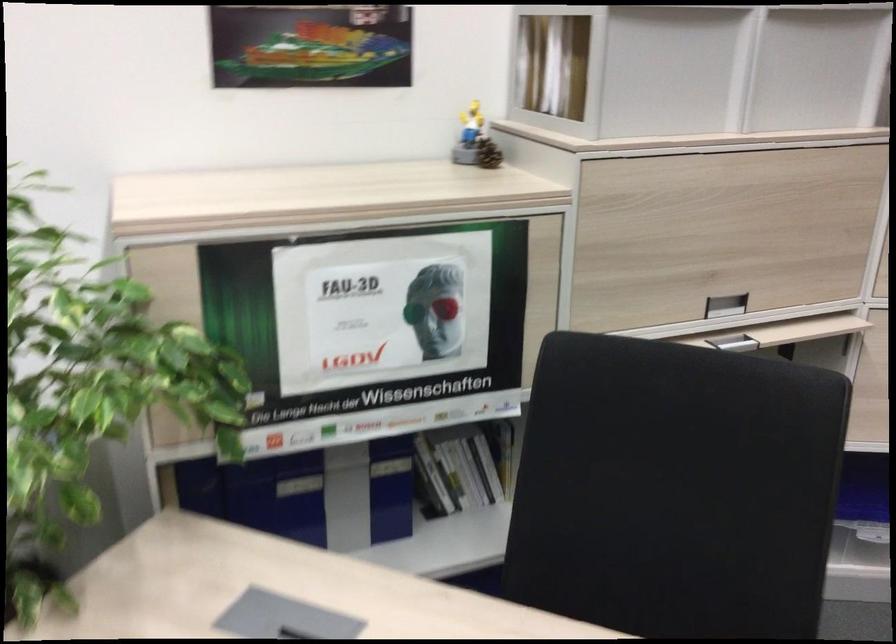
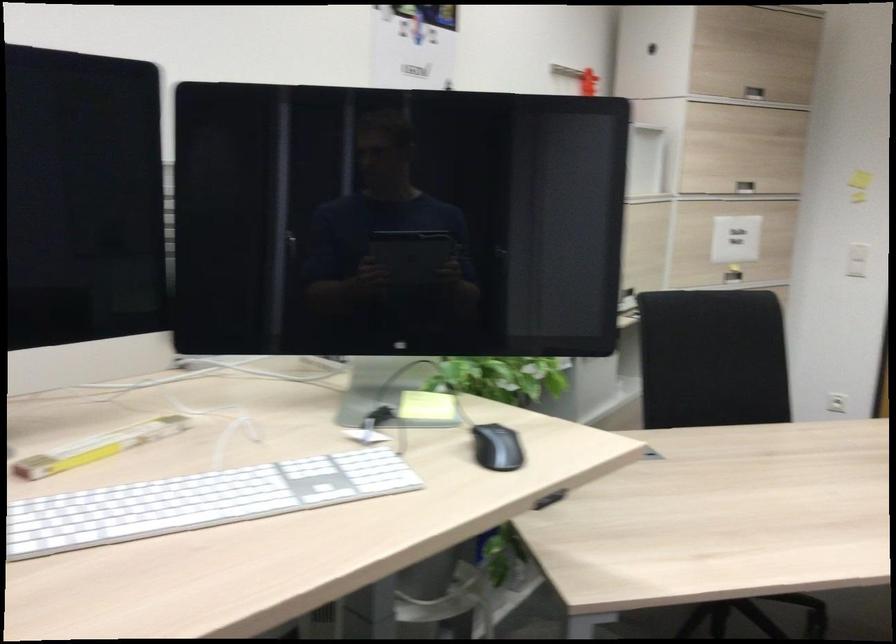
In the second image, find the point that corresponds to (649,475) in the first image.

(712, 359)